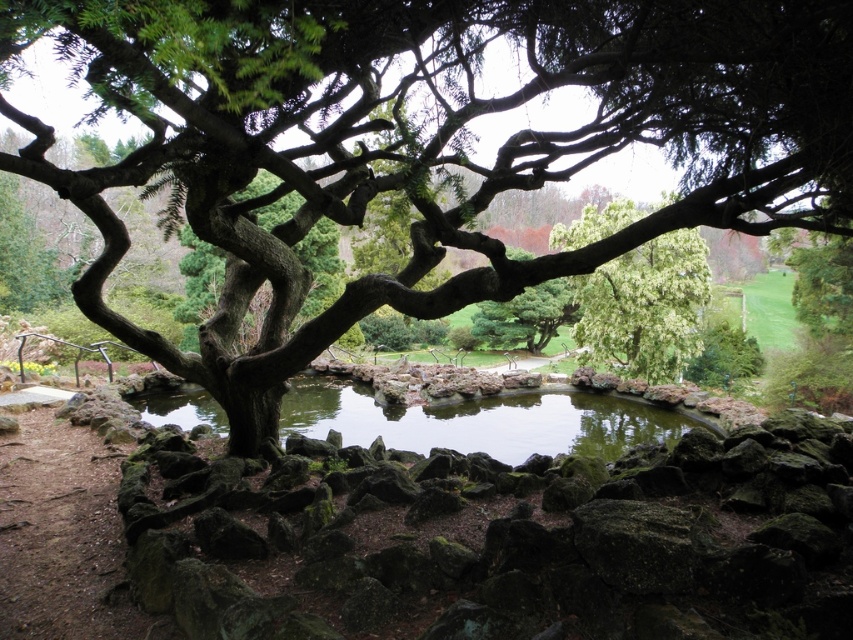
Question: Among these objects, which one is nearest to the camera?

Choices:
 (A) green leafy tree at center
 (B) clear water at center

Answer: (B)

Question: Which point appears farthest from the camera in this image?

Choices:
 (A) (1, 42)
 (B) (639, 410)

Answer: (B)

Question: Which of the following is the farthest from the observer?

Choices:
 (A) green leafy tree at center
 (B) clear water at center
 (C) green textured tree at center

Answer: (A)

Question: Can you confirm if green textured tree at center is thinner than green leafy tree at center?

Choices:
 (A) yes
 (B) no

Answer: (A)

Question: Does clear water at center lie in front of green leafy tree at center?

Choices:
 (A) no
 (B) yes

Answer: (B)

Question: Can you confirm if clear water at center is bigger than green leafy tree at center?

Choices:
 (A) yes
 (B) no

Answer: (A)